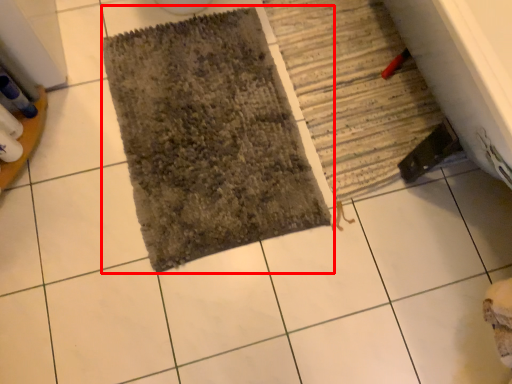
Question: Where is bath mat (annotated by the red box) located in relation to bath mat in the image?

Choices:
 (A) right
 (B) left

Answer: (B)